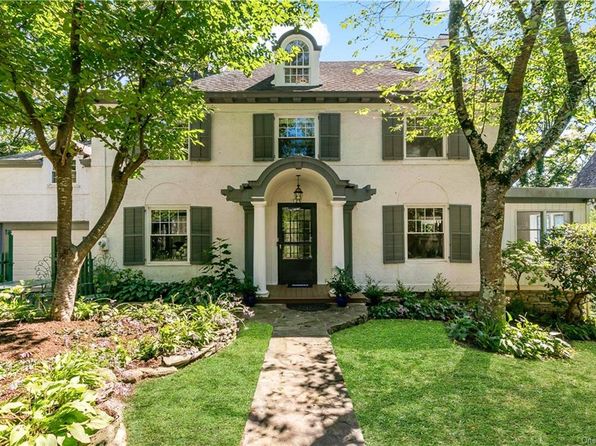
This screenshot has width=596, height=446. Find the location of `windows`. windows is located at coordinates (425, 236), (533, 223), (429, 149), (301, 136), (298, 68), (181, 155), (158, 253).